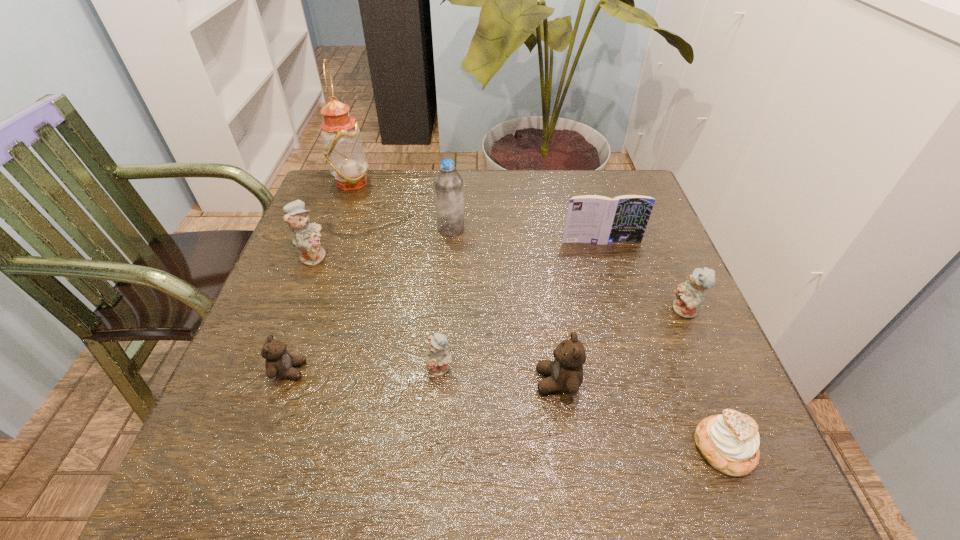
Locate an element on the screen. vacant space at the right edge is located at coordinates (680, 318).

In order to click on blank space at the far left corner of the desktop in this screenshot , I will do click(354, 216).

Find the location of `free space between the water bottle and the second blue teddy bear from left to right`. free space between the water bottle and the second blue teddy bear from left to right is located at coordinates (445, 299).

Locate an element on the screen. The image size is (960, 540). free space between the nearest object and the right brown teddy bear is located at coordinates (640, 415).

Where is `free space that is in between the rightmost teddy bear and the smallest blue teddy bear`? The image size is (960, 540). free space that is in between the rightmost teddy bear and the smallest blue teddy bear is located at coordinates (563, 339).

Locate an element on the screen. The image size is (960, 540). free spot between the eighth nearest object and the nearest object is located at coordinates (588, 339).

Locate an element on the screen. free area in between the fourth object from right to left and the nearest object is located at coordinates (640, 415).

The height and width of the screenshot is (540, 960). In order to click on unoccupied position between the farthest object and the smaller brown teddy bear in this screenshot , I will do `click(321, 276)`.

What are the coordinates of `free space that is in between the farthest object and the nearest object` in the screenshot? It's located at (538, 315).

I want to click on empty space that is in between the rightmost teddy bear and the nearest object, so click(705, 380).